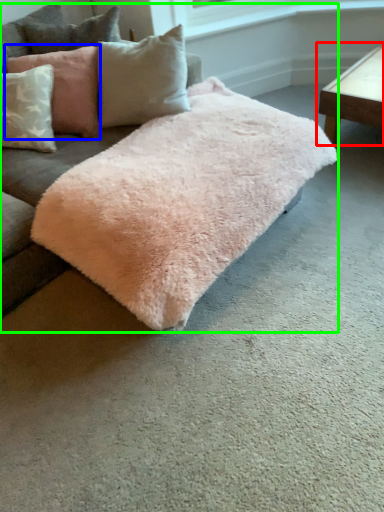
Question: Which object is positioned closest to table (highlighted by a red box)? Select from pillow (highlighted by a blue box) and studio couch (highlighted by a green box).

Choices:
 (A) pillow
 (B) studio couch

Answer: (B)